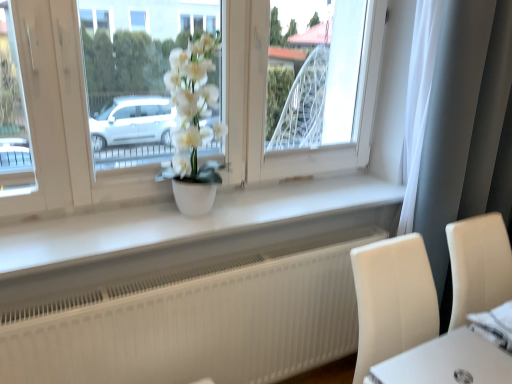
Question: Is point (489, 329) positioned closer to the camera than point (387, 375)?

Choices:
 (A) closer
 (B) farther

Answer: (B)

Question: In terms of width, does white fabric at lower right look wider or thinner when compared to white glossy round table at lower right?

Choices:
 (A) wide
 (B) thin

Answer: (B)

Question: Considering the real-world distances, which object is closest to the white matte flower pot at center?

Choices:
 (A) white sheer curtain at right
 (B) white glossy round table at lower right
 (C) white matte pot at center
 (D) white matte window sill at center
 (E) white fabric at lower right

Answer: (C)

Question: Estimate the real-world distances between objects in this image. Which object is farther from the white matte flower pot at center?

Choices:
 (A) white fabric at lower right
 (B) white glossy round table at lower right
 (C) white matte pot at center
 (D) white sheer curtain at right
 (E) white matte window sill at center

Answer: (B)